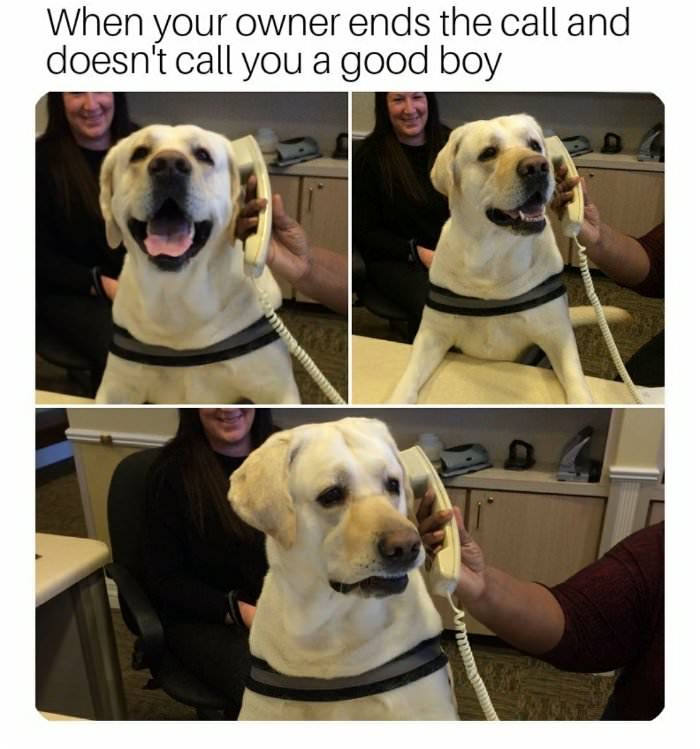
Locate an element on the screen. chair arm is located at coordinates (150, 622).